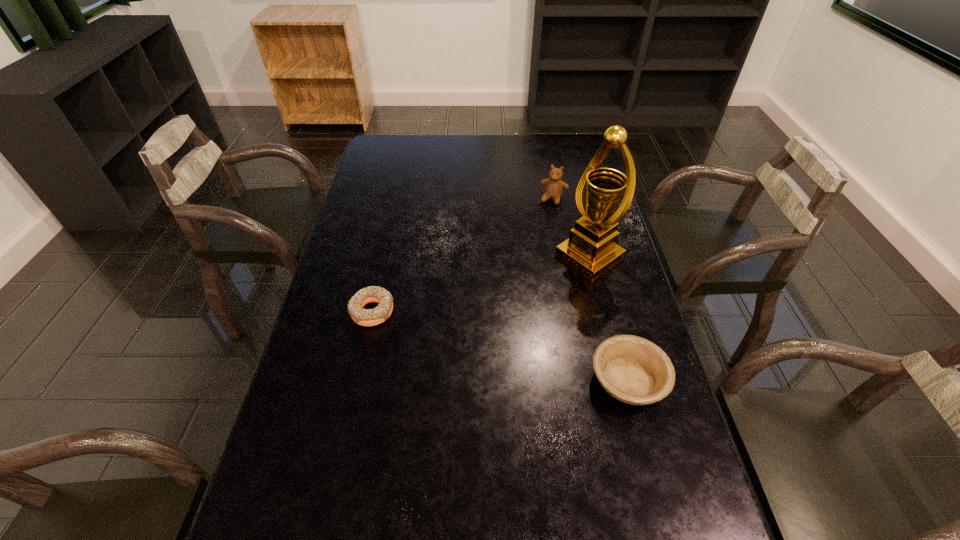
The height and width of the screenshot is (540, 960). I want to click on free space in the image that satisfies the following two spatial constraints: 1. on the back side of the third nearest object; 2. on the right side of the third farthest object, so click(x=384, y=256).

The width and height of the screenshot is (960, 540). In order to click on vacant position in the image that satisfies the following two spatial constraints: 1. on the back side of the tallest object; 2. on the right side of the third farthest object in this screenshot , I will do `click(384, 256)`.

Where is `blank area in the image that satisfies the following two spatial constraints: 1. on the front side of the farthest object; 2. on the left side of the bowl`? blank area in the image that satisfies the following two spatial constraints: 1. on the front side of the farthest object; 2. on the left side of the bowl is located at coordinates (589, 380).

Identify the location of vacant space that satisfies the following two spatial constraints: 1. on the front side of the third tallest object; 2. on the right side of the third nearest object. (620, 380).